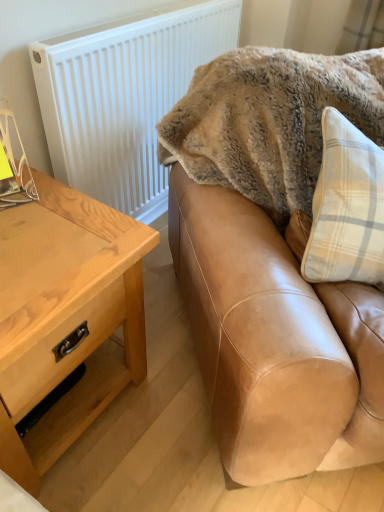
Measure the distance between point (321, 342) and camera.

Point (321, 342) is 29.92 inches away from camera.

Image resolution: width=384 pixels, height=512 pixels. What do you see at coordinates (275, 340) in the screenshot?
I see `tan leather couch at upper right` at bounding box center [275, 340].

You are a GUI agent. You are given a task and a screenshot of the screen. Output one action in this format:
    pyautogui.click(x=<x>, y=<y>)
    Task: Click on the white textured radiator at upper left
    
    Given the screenshot: What is the action you would take?
    pyautogui.click(x=124, y=97)

The width and height of the screenshot is (384, 512). Describe the element at coordinates (124, 97) in the screenshot. I see `white textured radiator at upper left` at that location.

Find the location of a particular element. The height and width of the screenshot is (512, 384). tan leather couch at upper right is located at coordinates (275, 340).

Considering the positions of objects tan leather couch at upper right and light brown wood table at left in the image provided, who is more to the right, tan leather couch at upper right or light brown wood table at left?

tan leather couch at upper right.

The width and height of the screenshot is (384, 512). I want to click on table to the left of tan leather couch at upper right, so click(70, 328).

From a real-world perspective, does tan leather couch at upper right sit lower than light brown wood table at left?

No, from a real-world perspective, tan leather couch at upper right is not beneath light brown wood table at left.

Who is taller, tan leather couch at upper right or light brown wood table at left?

Standing taller between the two is tan leather couch at upper right.

This screenshot has height=512, width=384. In the image, there is a white textured radiator at upper left. What are the coordinates of `blanket below it (from the image's perspective)` in the screenshot? It's located at (270, 121).

From the image's perspective, between white textured radiator at upper left and fuzzy beige blanket at upper right, which one is located above?

white textured radiator at upper left, from the image's perspective.

Would you say white textured radiator at upper left is outside fuzzy beige blanket at upper right?

Yes, white textured radiator at upper left is located beyond the bounds of fuzzy beige blanket at upper right.

Is light brown wood table at left turned away from tan leather couch at upper right?

No.

How much distance is there between light brown wood table at left and tan leather couch at upper right?

A distance of 14.30 inches exists between light brown wood table at left and tan leather couch at upper right.

Is light brown wood table at left with tan leather couch at upper right?

light brown wood table at left is not next to tan leather couch at upper right, and they're not touching.

Based on their sizes in the image, would you say light brown wood table at left is bigger or smaller than tan leather couch at upper right?

Clearly, light brown wood table at left is smaller in size than tan leather couch at upper right.

From the image's perspective, is fuzzy beige blanket at upper right above or below tan leather couch at upper right?

From the image's perspective, fuzzy beige blanket at upper right appears above tan leather couch at upper right.

In the scene shown: Can you confirm if fuzzy beige blanket at upper right is thinner than tan leather couch at upper right?

Yes.

Are fuzzy beige blanket at upper right and tan leather couch at upper right located far from each other?

They are positioned close to each other.

Is fuzzy beige blanket at upper right not near light brown wood table at left?

No, fuzzy beige blanket at upper right is in close proximity to light brown wood table at left.

Would you say fuzzy beige blanket at upper right is inside or outside light brown wood table at left?

fuzzy beige blanket at upper right exists outside the volume of light brown wood table at left.

From a real-world perspective, who is located higher, fuzzy beige blanket at upper right or light brown wood table at left?

fuzzy beige blanket at upper right.

Is fuzzy beige blanket at upper right oriented away from light brown wood table at left?

No, fuzzy beige blanket at upper right's orientation is not away from light brown wood table at left.

Considering the sizes of objects fuzzy beige blanket at upper right and white textured radiator at upper left in the image provided, who is thinner, fuzzy beige blanket at upper right or white textured radiator at upper left?

white textured radiator at upper left is thinner.

Is fuzzy beige blanket at upper right directly adjacent to white textured radiator at upper left?

There is a gap between fuzzy beige blanket at upper right and white textured radiator at upper left.

Where is `blanket located above the white textured radiator at upper left (from a real-world perspective)`? The width and height of the screenshot is (384, 512). blanket located above the white textured radiator at upper left (from a real-world perspective) is located at coordinates (270, 121).

Which is in front, fuzzy beige blanket at upper right or white textured radiator at upper left?

Positioned in front is fuzzy beige blanket at upper right.

Who is smaller, light brown wood table at left or fuzzy beige blanket at upper right?

fuzzy beige blanket at upper right.

Considering the relative sizes of light brown wood table at left and fuzzy beige blanket at upper right in the image provided, is light brown wood table at left taller than fuzzy beige blanket at upper right?

Yes, light brown wood table at left is taller than fuzzy beige blanket at upper right.

Is light brown wood table at left placed right next to fuzzy beige blanket at upper right?

No.

Is light brown wood table at left positioned beyond the bounds of fuzzy beige blanket at upper right?

That's correct, light brown wood table at left is outside of fuzzy beige blanket at upper right.

The image size is (384, 512). Find the location of `studio couch in front of the light brown wood table at left`. studio couch in front of the light brown wood table at left is located at coordinates (275, 340).

Locate an element on the screen. radiator that is above the fuzzy beige blanket at upper right (from the image's perspective) is located at coordinates (124, 97).

Based on the photo, from the image, which object appears to be farther from light brown wood table at left, white textured radiator at upper left or tan leather couch at upper right?

white textured radiator at upper left.

Estimate the real-world distances between objects in this image. Which object is closer to fuzzy beige blanket at upper right, tan leather couch at upper right or light brown wood table at left?

Based on the image, tan leather couch at upper right appears to be nearer to fuzzy beige blanket at upper right.

Estimate the real-world distances between objects in this image. Which object is further from light brown wood table at left, fuzzy beige blanket at upper right or tan leather couch at upper right?

fuzzy beige blanket at upper right lies further to light brown wood table at left than the other object.

Looking at the image, which one is located further to tan leather couch at upper right, white textured radiator at upper left or fuzzy beige blanket at upper right?

Among the two, white textured radiator at upper left is located further to tan leather couch at upper right.

Looking at the image, which one is located closer to white textured radiator at upper left, tan leather couch at upper right or fuzzy beige blanket at upper right?

fuzzy beige blanket at upper right lies closer to white textured radiator at upper left than the other object.

Which object lies further to the anchor point light brown wood table at left, fuzzy beige blanket at upper right or white textured radiator at upper left?

white textured radiator at upper left is positioned further to the anchor light brown wood table at left.

Based on their spatial positions, is light brown wood table at left or tan leather couch at upper right further from white textured radiator at upper left?

tan leather couch at upper right.

Looking at the image, which one is located further to fuzzy beige blanket at upper right, white textured radiator at upper left or light brown wood table at left?

light brown wood table at left.

I want to click on blanket between light brown wood table at left and tan leather couch at upper right from left to right, so click(270, 121).

Locate an element on the screen. The width and height of the screenshot is (384, 512). radiator situated between light brown wood table at left and tan leather couch at upper right from left to right is located at coordinates (124, 97).

You are a GUI agent. You are given a task and a screenshot of the screen. Output one action in this format:
    pyautogui.click(x=<x>, y=<y>)
    Task: Click on the radiator between light brown wood table at left and fuzzy beige blanket at upper right
    The height and width of the screenshot is (512, 384).
    Given the screenshot: What is the action you would take?
    pyautogui.click(x=124, y=97)

This screenshot has width=384, height=512. I want to click on blanket between white textured radiator at upper left and tan leather couch at upper right from left to right, so click(270, 121).